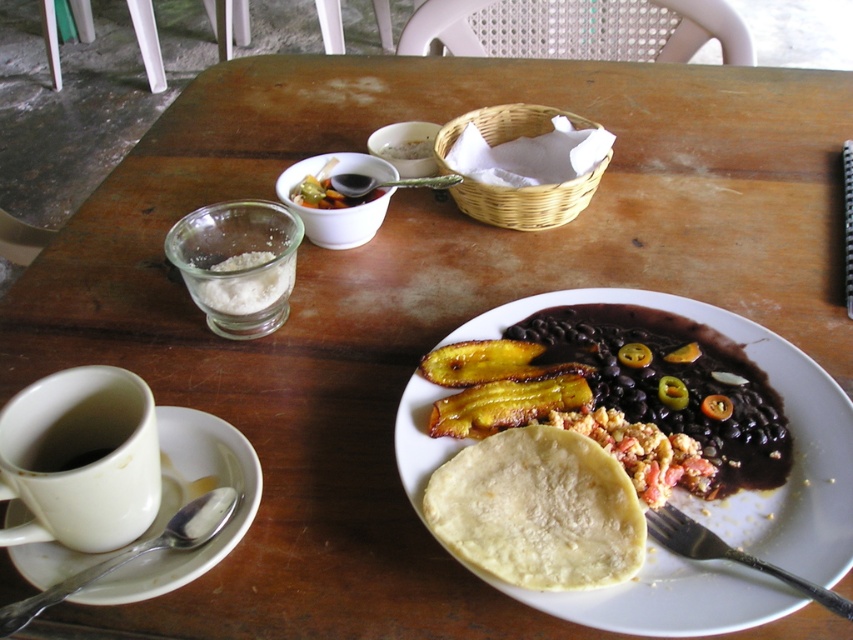
Question: Is matte white tortilla at lower center wider than white granular sugar at center?

Choices:
 (A) no
 (B) yes

Answer: (B)

Question: Which object appears closest to the camera in this image?

Choices:
 (A) yellow matte tortilla at center
 (B) silver metallic spoon at lower left

Answer: (B)

Question: In this image, where is matte white tortilla at lower center located relative to black metal fork at lower right?

Choices:
 (A) below
 (B) above

Answer: (B)

Question: Among these points, which one is farthest from the camera?

Choices:
 (A) (175, 440)
 (B) (476, 456)
 (C) (213, 513)
 (D) (809, 584)

Answer: (A)

Question: Which of the following is the closest to the observer?

Choices:
 (A) white ceramic cup at lower left
 (B) white granular sugar at center

Answer: (A)

Question: Is yellow matte tortilla at center further to camera compared to black metal fork at lower right?

Choices:
 (A) yes
 (B) no

Answer: (A)